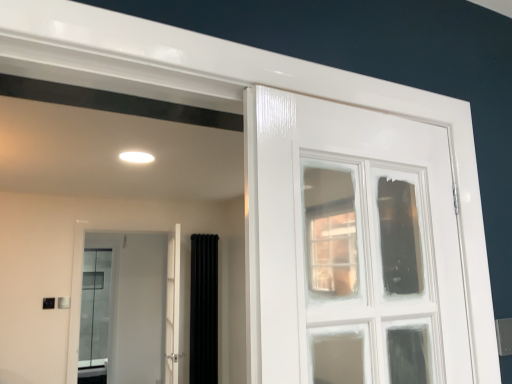
Question: Do you think white glossy door at center is within white glossy door at center, or outside of it?

Choices:
 (A) outside
 (B) inside

Answer: (A)

Question: Is point coord(129,336) closer or farther from the camera than point coord(169,377)?

Choices:
 (A) farther
 (B) closer

Answer: (A)

Question: Which object is the farthest from the black velvet curtain at center?

Choices:
 (A) white glossy door at center
 (B) white glossy door at center

Answer: (A)

Question: Which is nearer to the white glossy door at center?

Choices:
 (A) white glossy door at center
 (B) black velvet curtain at center

Answer: (B)